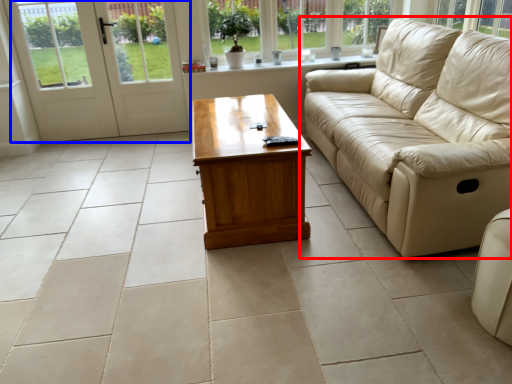
Question: Which point is further to the camera, studio couch (highlighted by a red box) or door (highlighted by a blue box)?

Choices:
 (A) studio couch
 (B) door

Answer: (B)